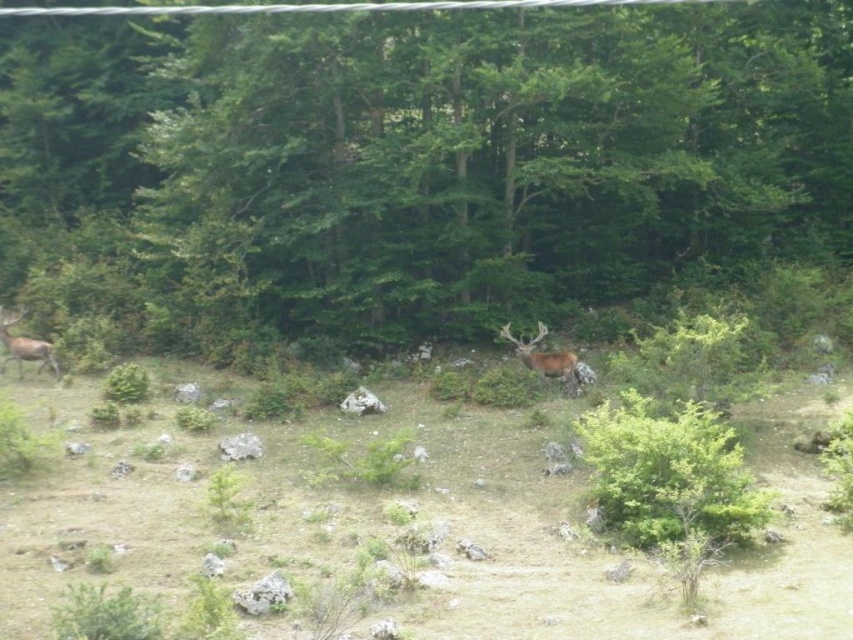
You are an archer standing in the clearing and need to shoot an arrow from the green leafy tree at center to the brown velvet deer at center. Will the arrow pass between them without hitting either?

The green leafy tree at center might be wider than brown velvet deer at center, so there is a possibility the arrow could hit the tree or the deer depending on the aim. Ensure precise targeting to avoid obstacles.

You are a hiker standing in the clearing of the forest scene. You notice a green leafy tree at center and a brown velvet deer at left. Which object is taller?

The green leafy tree at center is taller than the brown velvet deer at left.

You are a hiker in the forest and see a green leafy tree at center and a brown velvet deer at center. Which object is bigger in size?

The green leafy tree at center is larger in size than the brown velvet deer at center.